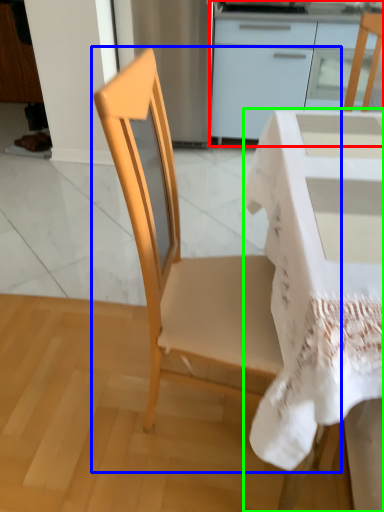
Question: Based on their relative distances, which object is farther from cabinetry (highlighted by a red box)? Choose from chair (highlighted by a blue box) and desk (highlighted by a green box).

Choices:
 (A) chair
 (B) desk

Answer: (A)